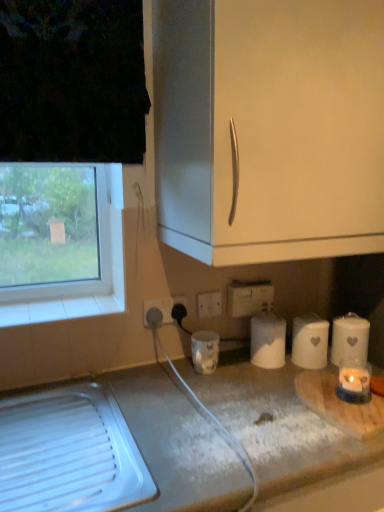
You are a GUI agent. You are given a task and a screenshot of the screen. Output one action in this format:
    pyautogui.click(x=<x>, y=<y>)
    Task: Click on the vacant region under white matte cabinet handle at upper center (from a real-world perspective)
    The width and height of the screenshot is (384, 512).
    Given the screenshot: What is the action you would take?
    pyautogui.click(x=247, y=382)